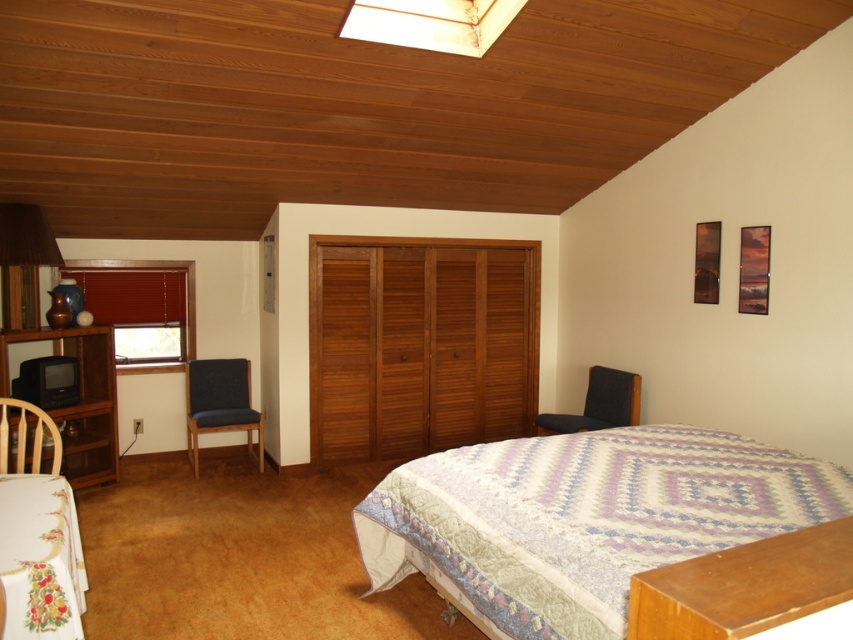
Question: Observing the image, what is the correct spatial positioning of matte wood lampshade at upper center in reference to dark gray fabric chair at lower right?

Choices:
 (A) right
 (B) left

Answer: (B)

Question: Can you confirm if black wood dresser at left is positioned to the left of brown fabric lampshade at left?

Choices:
 (A) yes
 (B) no

Answer: (B)

Question: Which of the following is the farthest from the observer?

Choices:
 (A) (392, 483)
 (B) (543, 432)
 (C) (526, 314)

Answer: (C)

Question: Which point is farther to the camera?

Choices:
 (A) (0, 396)
 (B) (744, 516)
 (C) (7, 301)

Answer: (C)

Question: Estimate the real-world distances between objects in this image. Which object is closer to the black wood dresser at left?

Choices:
 (A) patterned fabric bed at center
 (B) wooden armchair at lower left

Answer: (B)

Question: Can you confirm if wooden closet at center is positioned to the left of wooden armchair at lower left?

Choices:
 (A) no
 (B) yes

Answer: (A)